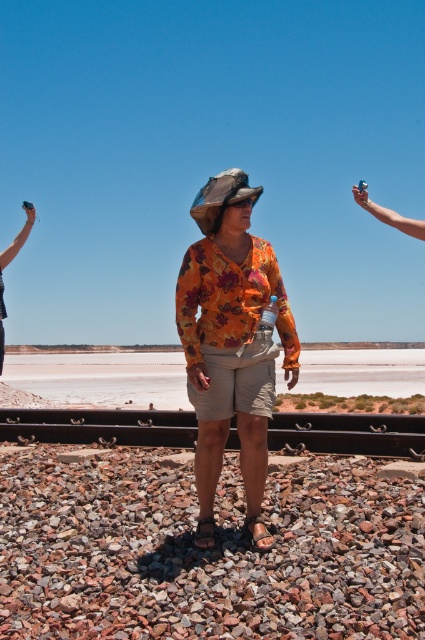
Question: Which point is farther to the camera?

Choices:
 (A) (277, 577)
 (B) (212, 301)
 (C) (285, 417)
 (D) (19, 244)

Answer: (D)

Question: Is floral fabric shirt at center below black metal train track at center?

Choices:
 (A) yes
 (B) no

Answer: (B)

Question: Which point is closer to the camera?

Choices:
 (A) (340, 600)
 (B) (251, 380)
 (C) (65, 440)
 (D) (2, 316)

Answer: (A)

Question: Which point appears farthest from the camera in this image?

Choices:
 (A) (147, 412)
 (B) (11, 246)
 (C) (249, 451)
 (D) (396, 611)

Answer: (B)

Question: Can you confirm if floral fabric shirt at center is positioned to the right of metallic silver knife at left?

Choices:
 (A) yes
 (B) no

Answer: (A)

Question: Is black metal train track at center further to the viewer compared to metallic silver knife at left?

Choices:
 (A) no
 (B) yes

Answer: (A)